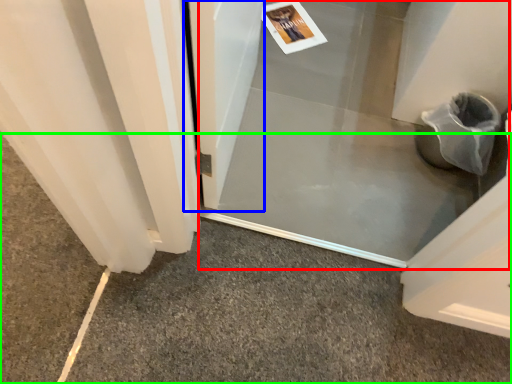
Question: Based on their relative distances, which object is farther from screen door (highlighted by a red box)? Choose from screen door (highlighted by a blue box) and concrete (highlighted by a green box).

Choices:
 (A) screen door
 (B) concrete

Answer: (B)